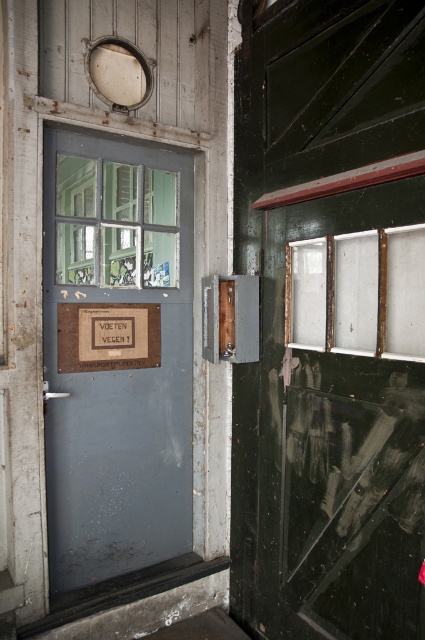
You are a delivery person standing at the entrance of an old building. You need to deliver a package to the office behind the rusty metal door at center. The package is 2 meters long. Can you carry the package through the doorway without tilting it? Please explain your reasoning.

The rusty metal door at center is 2.25 meters away from the camera. Since the package is 2 meters long, it can be carried through the doorway without tilting as the distance from the camera to the door is sufficient. However, this assumes the doorway height and width are adequate, which isn not specified in the provided information.

You are standing in the old building and need to locate the rusty metal door at center. According to the coordinates provided, where should you look to find it?

The rusty metal door at center is located at coordinates point (116, 355).